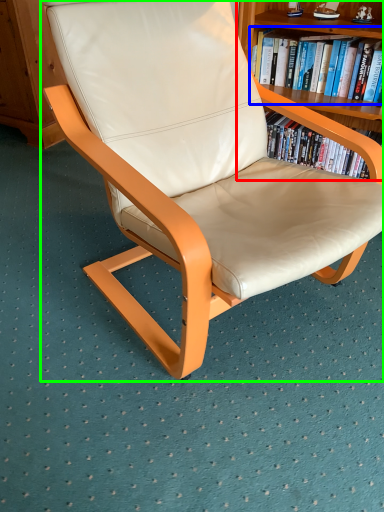
Question: Based on their relative distances, which object is farther from bookcase (highlighted by a red box)? Choose from book (highlighted by a blue box) and chair (highlighted by a green box).

Choices:
 (A) book
 (B) chair

Answer: (B)